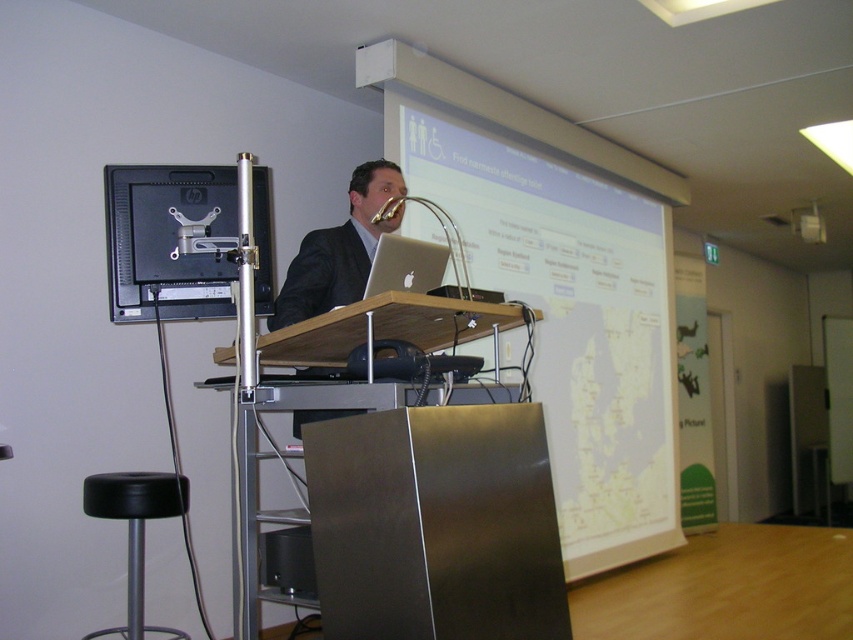
Can you confirm if white matte projection screen at center is wider than metallic silver speaker at lower center?

Yes.

Is white matte projection screen at center shorter than metallic silver speaker at lower center?

Incorrect, white matte projection screen at center's height does not fall short of metallic silver speaker at lower center's.

Locate an element on the screen. white matte projection screen at center is located at coordinates (567, 316).

Can you confirm if black rubber stool at lower left is smaller than metallic silver speaker at lower center?

Actually, black rubber stool at lower left might be larger than metallic silver speaker at lower center.

Between point (134, 556) and point (265, 570), which one is positioned in front?

Point (265, 570) is more forward.

The height and width of the screenshot is (640, 853). In order to click on black rubber stool at lower left in this screenshot , I will do `click(135, 529)`.

Locate an element on the screen. Image resolution: width=853 pixels, height=640 pixels. black rubber stool at lower left is located at coordinates (135, 529).

Is point (645, 448) closer to camera compared to point (367, 292)?

No.

Is white matte projection screen at center closer to the viewer compared to silver metallic laptop at center?

That is False.

What are the coordinates of `white matte projection screen at center` in the screenshot? It's located at tap(567, 316).